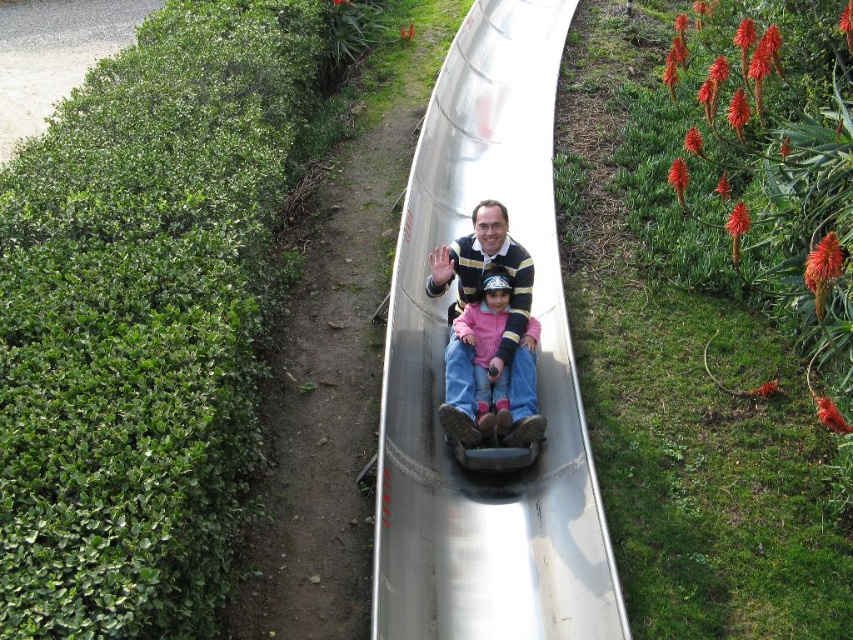
Does metallic smooth slide at center have a smaller size compared to matte pink sweater at center?

Actually, metallic smooth slide at center might be larger than matte pink sweater at center.

The width and height of the screenshot is (853, 640). In order to click on metallic smooth slide at center in this screenshot , I will do `click(454, 348)`.

Who is positioned more to the right, green leafy hedge at left or metallic smooth slide at center?

Positioned to the right is metallic smooth slide at center.

Does green leafy hedge at left appear over metallic smooth slide at center?

No.

Locate an element on the screen. green leafy hedge at left is located at coordinates (154, 308).

Consider the image. Is green leafy hedge at left below matte pink sweater at center?

Correct, green leafy hedge at left is located below matte pink sweater at center.

Which is in front, point (225, 589) or point (527, 323)?

Point (225, 589) is in front.

What do you see at coordinates (154, 308) in the screenshot?
I see `green leafy hedge at left` at bounding box center [154, 308].

Locate an element on the screen. This screenshot has width=853, height=640. green leafy hedge at left is located at coordinates (154, 308).